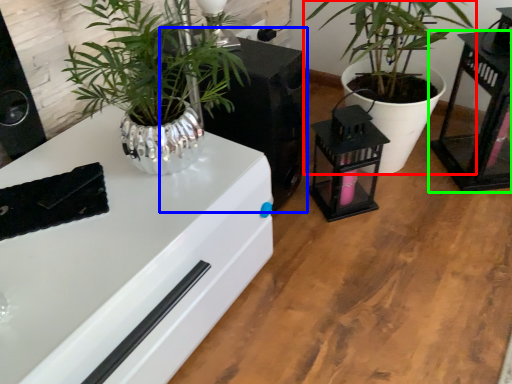
Question: Considering the real-world distances, which object is farthest from houseplant (highlighted by a red box)? appliance (highlighted by a blue box) or table (highlighted by a green box)?

Choices:
 (A) appliance
 (B) table

Answer: (A)